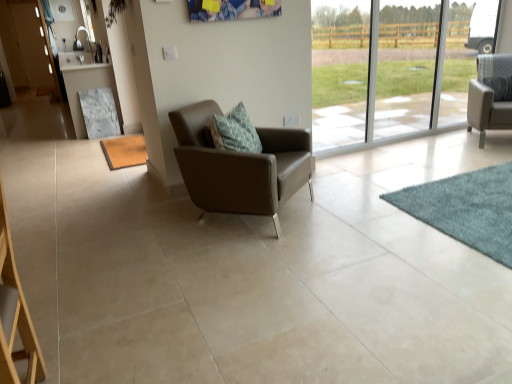
Find the location of a particular element. The width and height of the screenshot is (512, 384). transparent glass window at right is located at coordinates (411, 74).

Identify the location of brown textured mat at lower left, arranged as the 2th mat when viewed from the right. (124, 151).

Could you tell me if matte gray armchair at right, the first chair when ordered from back to front, is turned towards brown leather armchair at center, the first chair viewed from the front?

No, matte gray armchair at right, the first chair when ordered from back to front, is not facing towards brown leather armchair at center, the first chair viewed from the front.

Find the location of a particular element. Image resolution: width=512 pixels, height=384 pixels. chair on the right of brown leather armchair at center, arranged as the 1th chair when viewed from the left is located at coordinates pyautogui.click(x=490, y=95).

From the image's perspective, is matte gray armchair at right, the first chair when ordered from back to front, on top of brown leather armchair at center, the second chair viewed from the right?

Yes, from the image's perspective, matte gray armchair at right, the first chair when ordered from back to front, is over brown leather armchair at center, the second chair viewed from the right.

Considering the relative sizes of matte gray armchair at right, the first chair when ordered from back to front, and brown leather armchair at center, arranged as the 1th chair when viewed from the left, in the image provided, is matte gray armchair at right, the first chair when ordered from back to front, taller than brown leather armchair at center, arranged as the 1th chair when viewed from the left,?

Yes, matte gray armchair at right, the first chair when ordered from back to front, is taller than brown leather armchair at center, arranged as the 1th chair when viewed from the left.

Does marble table at left touch brown textured mat at lower left, the 2th mat ordered from the bottom?

No, marble table at left is not touching brown textured mat at lower left, the 2th mat ordered from the bottom.

From the picture: Does marble table at left come in front of brown textured mat at lower left, which is the 2th mat in front-to-back order?

No, the depth of marble table at left is greater than that of brown textured mat at lower left, which is the 2th mat in front-to-back order.

Between point (77, 87) and point (132, 161), which one is positioned in front?

The point (132, 161) is in front.

Is marble table at left aimed at brown textured mat at lower left, the 2th mat ordered from the bottom?

No, marble table at left is not turned towards brown textured mat at lower left, the 2th mat ordered from the bottom.

Where is `the 1st chair in front when counting from the marble table at left`? This screenshot has height=384, width=512. the 1st chair in front when counting from the marble table at left is located at coordinates (490, 95).

From the image's perspective, which object appears higher, matte gray armchair at right, the second chair viewed from the front, or marble table at left?

marble table at left, from the image's perspective.

Which object is positioned more to the left, matte gray armchair at right, the 1th chair when ordered from right to left, or marble table at left?

Positioned to the left is marble table at left.

Which point is more forward, (x=510, y=64) or (x=77, y=65)?

Point (x=510, y=64)

Is teal carpet at lower right, the second mat when ordered from top to bottom, to the left of transparent glass window at right from the viewer's perspective?

In fact, teal carpet at lower right, the second mat when ordered from top to bottom, is to the right of transparent glass window at right.

Is the surface of teal carpet at lower right, which ranks as the first mat in right-to-left order, in direct contact with transparent glass window at right?

No, teal carpet at lower right, which ranks as the first mat in right-to-left order, is not making contact with transparent glass window at right.

Does teal carpet at lower right, which is the first mat from bottom to top, contain transparent glass window at right?

Definitely not — transparent glass window at right is not inside teal carpet at lower right, which is the first mat from bottom to top.

Who is more distant, teal carpet at lower right, which ranks as the first mat in right-to-left order, or transparent glass window at right?

transparent glass window at right is further away from the camera.

Identify the location of screen door located above the brown textured mat at lower left, arranged as the 1th mat when viewed from the back (from the image's perspective). The image size is (512, 384). (34, 43).

How many degrees apart are the facing directions of brown textured mat at lower left, arranged as the 2th mat when viewed from the right, and matte wood screen door at upper left?

The facing directions of brown textured mat at lower left, arranged as the 2th mat when viewed from the right, and matte wood screen door at upper left are 90.1 degrees apart.

Which is in front, point (108, 150) or point (45, 65)?

The point (108, 150) is more forward.

Does brown textured mat at lower left, the first mat viewed from the top, contain matte wood screen door at upper left?

No, matte wood screen door at upper left is not surrounded by brown textured mat at lower left, the first mat viewed from the top.

Is matte gray armchair at right, which appears as the second chair when viewed from the left, looking in the opposite direction of brown textured mat at lower left, arranged as the 1th mat when viewed from the back?

matte gray armchair at right, which appears as the second chair when viewed from the left, is not turned away from brown textured mat at lower left, arranged as the 1th mat when viewed from the back.

The image size is (512, 384). What are the coordinates of `the 1st chair in front of the brown textured mat at lower left, the 2th mat ordered from the bottom` in the screenshot? It's located at coord(490,95).

Considering the relative sizes of matte gray armchair at right, the first chair when ordered from back to front, and brown textured mat at lower left, the 1th mat from the left, in the image provided, is matte gray armchair at right, the first chair when ordered from back to front, taller than brown textured mat at lower left, the 1th mat from the left,?

Indeed, matte gray armchair at right, the first chair when ordered from back to front, has a greater height compared to brown textured mat at lower left, the 1th mat from the left.

Considering the relative positions of matte wood screen door at upper left and marble table at left in the image provided, is matte wood screen door at upper left to the left or to the right of marble table at left?

matte wood screen door at upper left is to the left of marble table at left.

Which is behind, point (44, 72) or point (67, 66)?

The point (44, 72) is behind.

Is matte wood screen door at upper left positioned with its back to marble table at left?

No, matte wood screen door at upper left is not facing away from marble table at left.

Identify the location of chair below the matte gray armchair at right, the first chair when ordered from back to front (from the image's perspective). (240, 166).

Identify the location of table behind the brown textured mat at lower left, the first mat viewed from the top. (84, 84).

Based on their spatial positions, is brown textured mat at lower left, arranged as the 1th mat when viewed from the back, or teal carpet at lower right, arranged as the 1th mat when viewed from the front, closer to brown leather armchair at center, arranged as the 1th chair when viewed from the left?

teal carpet at lower right, arranged as the 1th mat when viewed from the front, lies closer to brown leather armchair at center, arranged as the 1th chair when viewed from the left, than the other object.

Looking at the image, which one is located closer to teal carpet at lower right, arranged as the 1th mat when viewed from the front, matte wood screen door at upper left or brown leather armchair at center, the first chair viewed from the front?

The object closer to teal carpet at lower right, arranged as the 1th mat when viewed from the front, is brown leather armchair at center, the first chair viewed from the front.

When comparing their distances from marble table at left, does matte wood screen door at upper left or matte gray armchair at right, the first chair when ordered from back to front, seem further?

The object further to marble table at left is matte gray armchair at right, the first chair when ordered from back to front.

Based on their spatial positions, is marble table at left or matte wood screen door at upper left further from transparent glass window at right?

matte wood screen door at upper left is positioned further to the anchor transparent glass window at right.

Based on their spatial positions, is brown leather armchair at center, the first chair viewed from the front, or marble table at left closer to matte wood screen door at upper left?

marble table at left.

Looking at the image, which one is located further to transparent glass window at right, matte gray armchair at right, which appears as the second chair when viewed from the left, or matte wood screen door at upper left?

Among the two, matte wood screen door at upper left is located further to transparent glass window at right.

From the image, which object appears to be nearer to brown textured mat at lower left, the 2th mat ordered from the bottom, brown leather armchair at center, arranged as the 1th chair when viewed from the left, or matte gray armchair at right, the second chair viewed from the front?

brown leather armchair at center, arranged as the 1th chair when viewed from the left, is positioned closer to the anchor brown textured mat at lower left, the 2th mat ordered from the bottom.

From the image, which object appears to be nearer to brown textured mat at lower left, which is the 2th mat in front-to-back order, matte wood screen door at upper left or transparent glass window at right?

transparent glass window at right.

This screenshot has height=384, width=512. I want to click on window situated between matte wood screen door at upper left and matte gray armchair at right, which appears as the second chair when viewed from the left, from left to right, so click(x=411, y=74).

Locate an element on the screen. mat between brown leather armchair at center, the 2th chair from the back, and matte gray armchair at right, the first chair when ordered from back to front, in the horizontal direction is located at coordinates (466, 209).

The image size is (512, 384). In order to click on window between teal carpet at lower right, the second mat when ordered from top to bottom, and matte gray armchair at right, which appears as the second chair when viewed from the left, from front to back in this screenshot , I will do `click(411, 74)`.

Identify the location of table between matte wood screen door at upper left and transparent glass window at right in the horizontal direction. (84, 84).